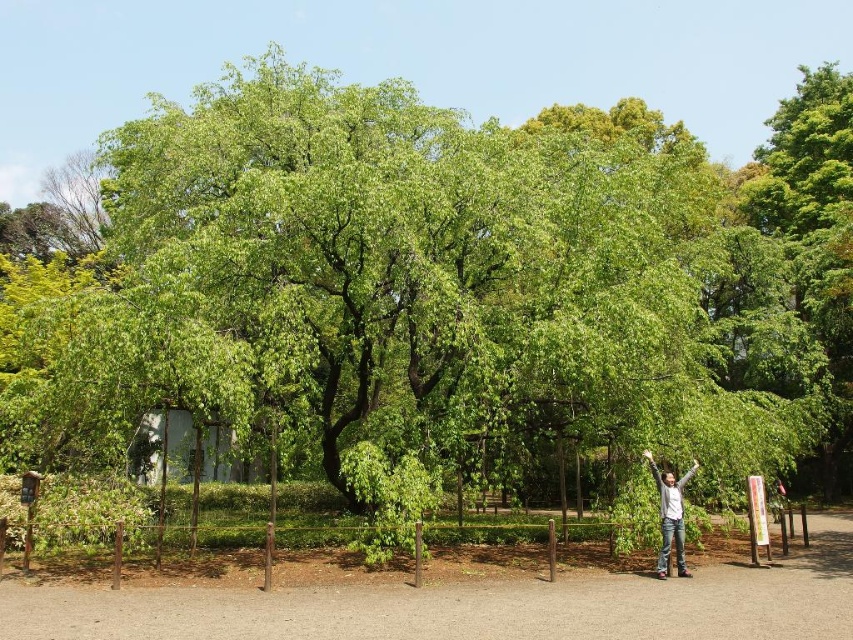
You are standing on the paved pathway in the park and notice the brown soil at lower center and the gray cotton shirt at center. Which object is wider?

The brown soil at lower center is wider than the gray cotton shirt at center.

You are standing at the point with coordinates point (227, 595) and want to walk towards the point with coordinates point (213, 467). Based on the scene description, will you have to walk through the tree canopy or around it?

Based on the scene description, the point (227, 595) is in front of point (213, 467). Since the tree has a sprawling canopy creating a natural archway, you would need to walk around the tree canopy rather than through it to reach the destination point.